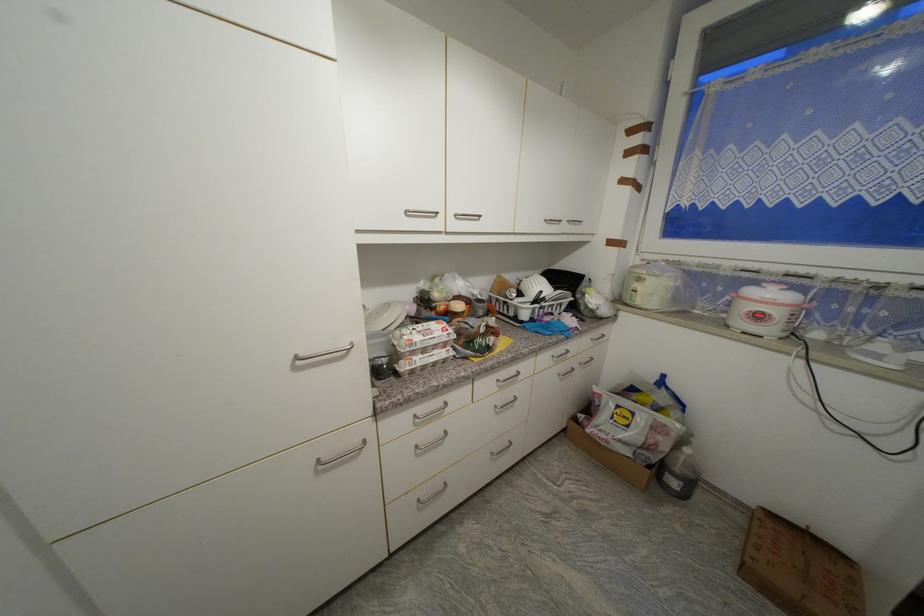
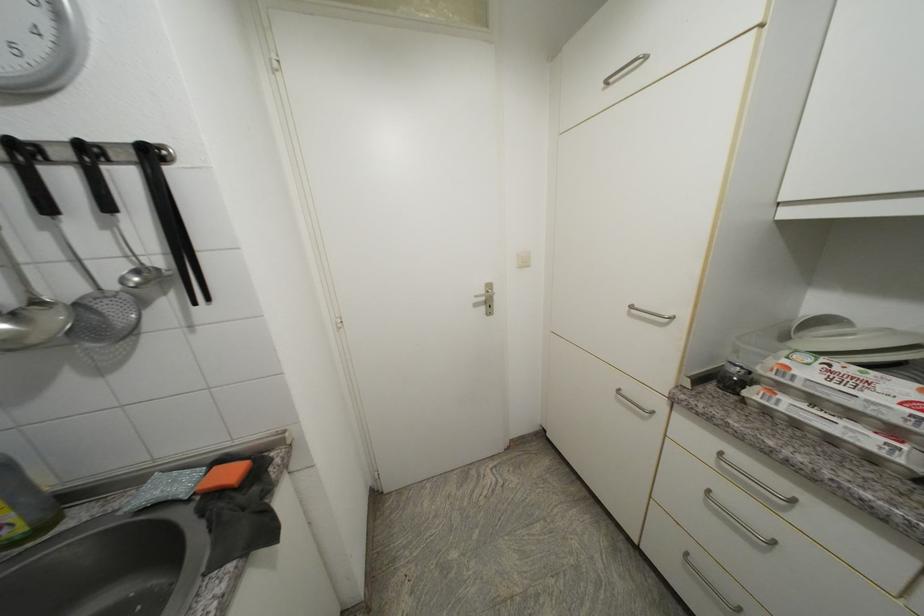
Based on the continuous images, in which direction is the camera rotating?

The camera rotated toward left-down.